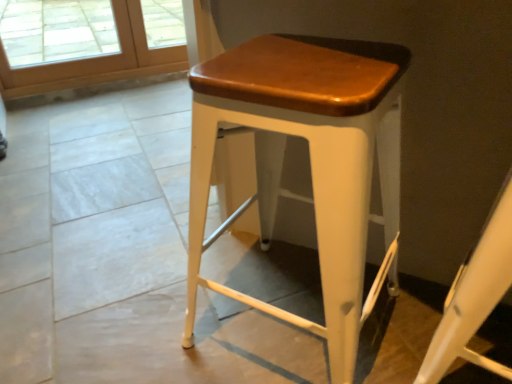
Question: Is matte white stool at center positioned before white matte stool at center?

Choices:
 (A) no
 (B) yes

Answer: (A)

Question: Does matte white stool at center have a smaller size compared to white matte stool at center?

Choices:
 (A) no
 (B) yes

Answer: (A)

Question: Is white matte stool at center located within matte white stool at center?

Choices:
 (A) yes
 (B) no

Answer: (B)

Question: From a real-world perspective, is matte white stool at center on white matte stool at center?

Choices:
 (A) yes
 (B) no

Answer: (B)

Question: Is matte white stool at center positioned beyond the bounds of white matte stool at center?

Choices:
 (A) no
 (B) yes

Answer: (B)

Question: From the image's perspective, is matte white stool at center above white matte stool at center?

Choices:
 (A) no
 (B) yes

Answer: (B)

Question: Can you confirm if wooden screen door at upper left is taller than matte white stool at center?

Choices:
 (A) no
 (B) yes

Answer: (A)

Question: Can you confirm if wooden screen door at upper left is shorter than matte white stool at center?

Choices:
 (A) no
 (B) yes

Answer: (B)

Question: Is wooden screen door at upper left located outside matte white stool at center?

Choices:
 (A) yes
 (B) no

Answer: (A)

Question: From a real-world perspective, is wooden screen door at upper left physically below matte white stool at center?

Choices:
 (A) yes
 (B) no

Answer: (A)

Question: From the image's perspective, is wooden screen door at upper left below matte white stool at center?

Choices:
 (A) no
 (B) yes

Answer: (A)

Question: Is wooden screen door at upper left thinner than matte white stool at center?

Choices:
 (A) yes
 (B) no

Answer: (A)

Question: From the image's perspective, is wooden screen door at upper left beneath white matte stool at center?

Choices:
 (A) no
 (B) yes

Answer: (A)